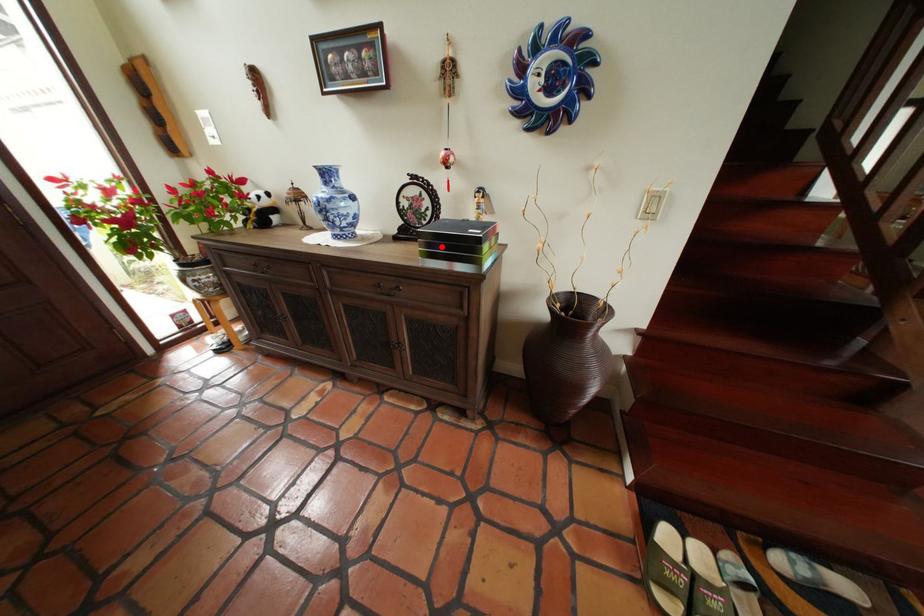
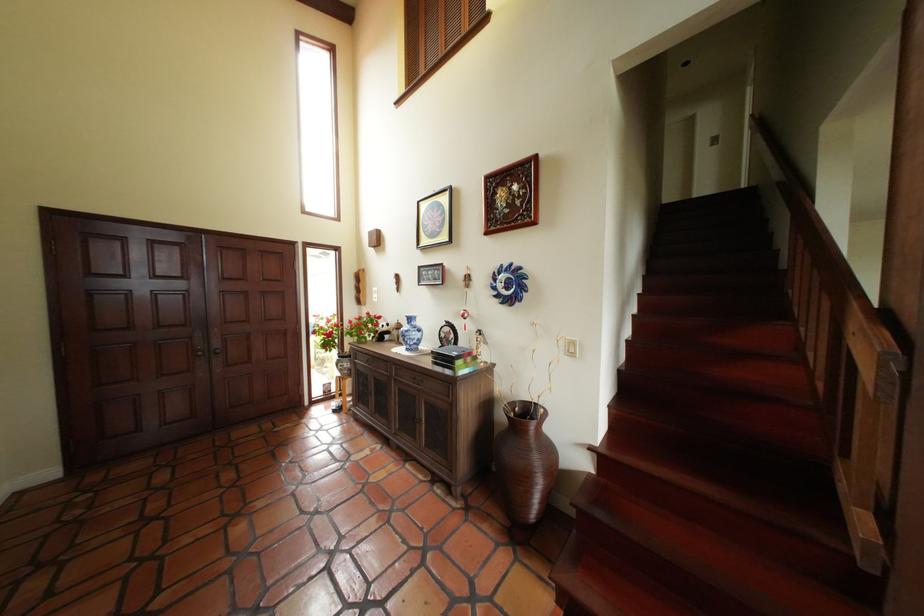
Locate, in the second image, the point that corresponds to the highlighted location in the first image.

(448, 360)